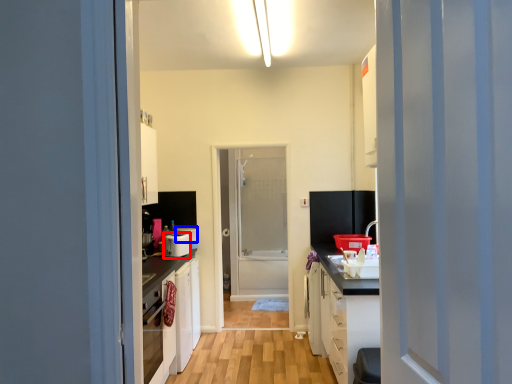
Question: Which point is closer to the camera, appliance (highlighted by a red box) or appliance (highlighted by a blue box)?

Choices:
 (A) appliance
 (B) appliance

Answer: (A)